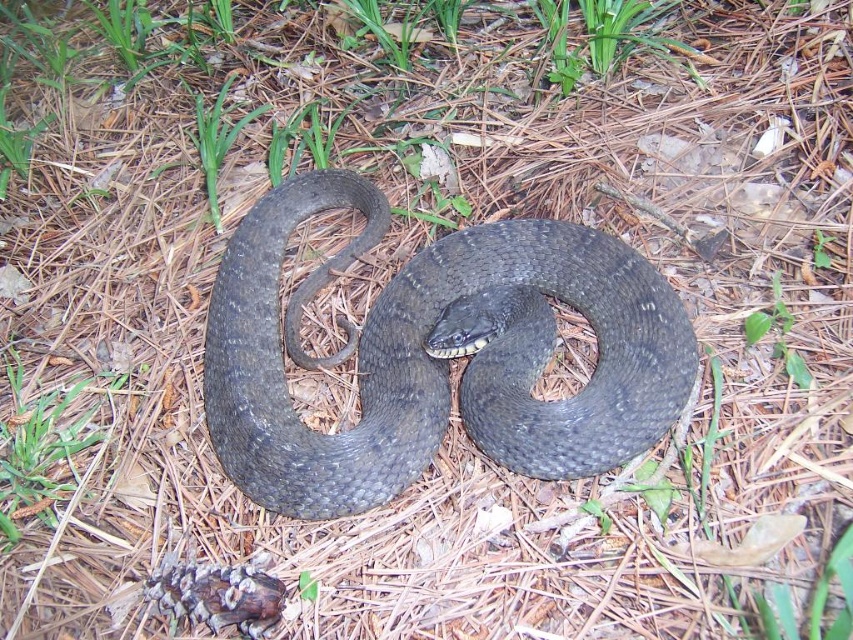
Question: Which point is farther to the camera?

Choices:
 (A) green matte grass at lower left
 (B) shiny dark gray snake at center

Answer: (A)

Question: Which object is closer to the camera taking this photo?

Choices:
 (A) shiny dark gray snake at center
 (B) green matte grass at lower left

Answer: (A)

Question: Among these objects, which one is nearest to the camera?

Choices:
 (A) green matte grass at lower left
 (B) shiny dark gray snake at center

Answer: (B)

Question: Observing the image, what is the correct spatial positioning of shiny dark gray snake at center in reference to green matte grass at lower left?

Choices:
 (A) above
 (B) below

Answer: (A)

Question: Considering the relative positions of shiny dark gray snake at center and green matte grass at lower left in the image provided, where is shiny dark gray snake at center located with respect to green matte grass at lower left?

Choices:
 (A) right
 (B) left

Answer: (A)

Question: Considering the relative positions of shiny dark gray snake at center and green matte grass at lower left in the image provided, where is shiny dark gray snake at center located with respect to green matte grass at lower left?

Choices:
 (A) above
 (B) below

Answer: (A)